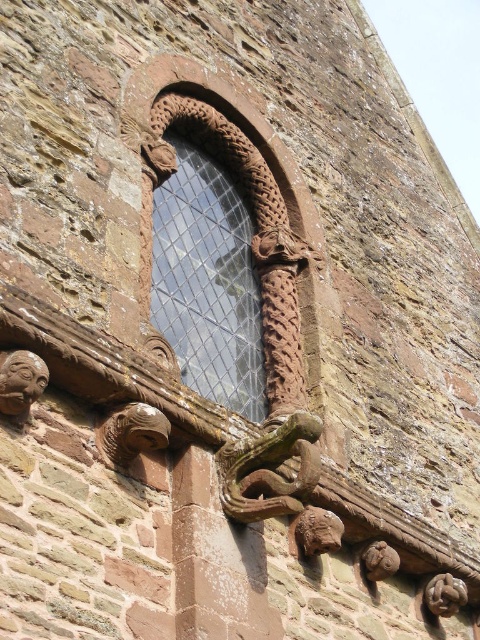
You are an architect examining the stone wall and want to determine the spatial relationship between the carved stone window at upper center and the matte stone face at upper left. Based on the scene, which object is positioned closer to the viewer?

The carved stone window at upper center is closer to the viewer than the matte stone face at upper left, as the matte stone face is situated behind it.

You are an architect examining the stone wall and need to determine the relative sizes of the carved stone window at upper center and the matte stone face at upper left. Which object is bigger?

The carved stone window at upper center has a larger size compared to the matte stone face at upper left, so the carved stone window at upper center is bigger.